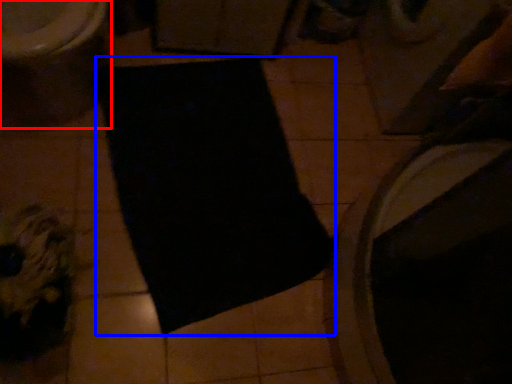
Question: Among these objects, which one is farthest to the camera, toilet (highlighted by a red box) or yoga mat (highlighted by a blue box)?

Choices:
 (A) toilet
 (B) yoga mat

Answer: (B)